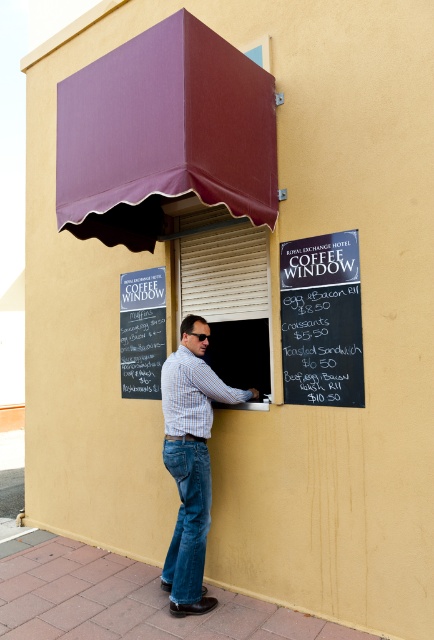
Question: Which of the following is the closest to the observer?

Choices:
 (A) (334, 381)
 (B) (164, 413)
 (C) (249, 404)
 (D) (206, 456)

Answer: (A)

Question: Is beige/textured roller shutter at center positioned behind blue plaid shirt at center?

Choices:
 (A) yes
 (B) no

Answer: (A)

Question: Does black chalkboard at center have a lesser width compared to blue plaid shirt at center?

Choices:
 (A) no
 (B) yes

Answer: (B)

Question: Which of these objects is positioned farthest from the denim jeans at center?

Choices:
 (A) black chalkboard at center
 (B) beige/textured roller shutter at center

Answer: (B)

Question: Which of the following is the farthest from the observer?

Choices:
 (A) beige/textured roller shutter at center
 (B) denim jeans at center

Answer: (A)

Question: Can you confirm if beige/textured roller shutter at center is bigger than light blue plaid shirt at center?

Choices:
 (A) yes
 (B) no

Answer: (B)